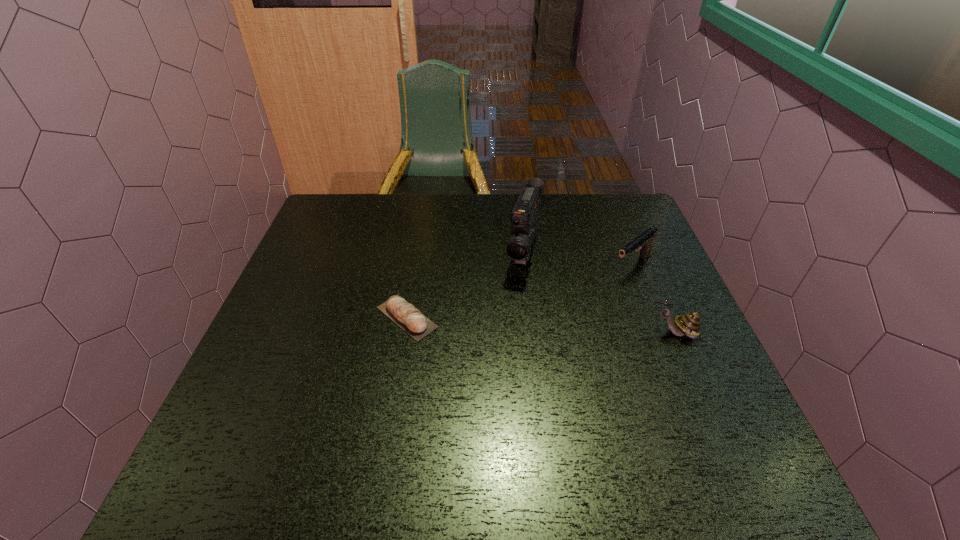
This screenshot has width=960, height=540. What are the coordinates of `blank area in the image that satisfies the following two spatial constraints: 1. on the front side of the pistol; 2. on the left side of the camcorder` in the screenshot? It's located at (525, 266).